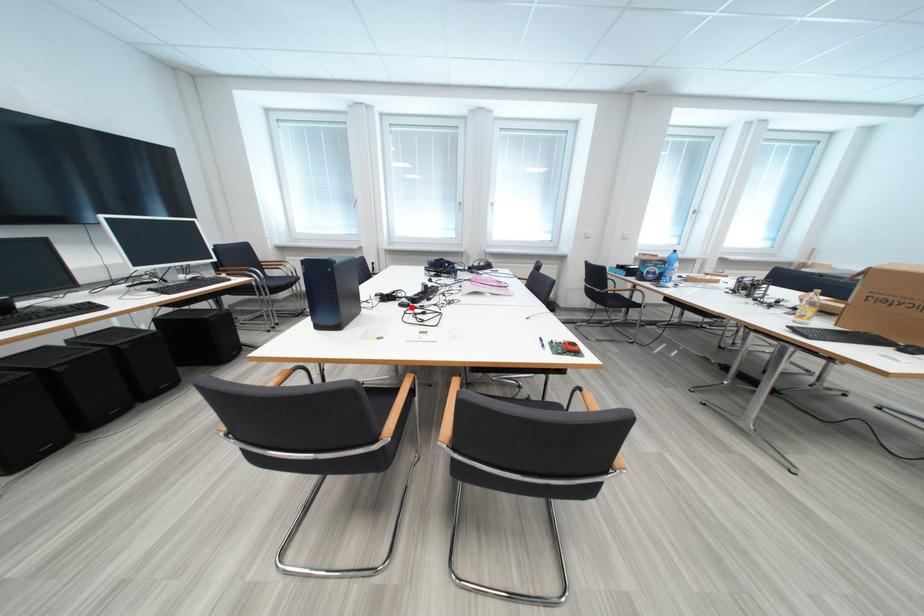
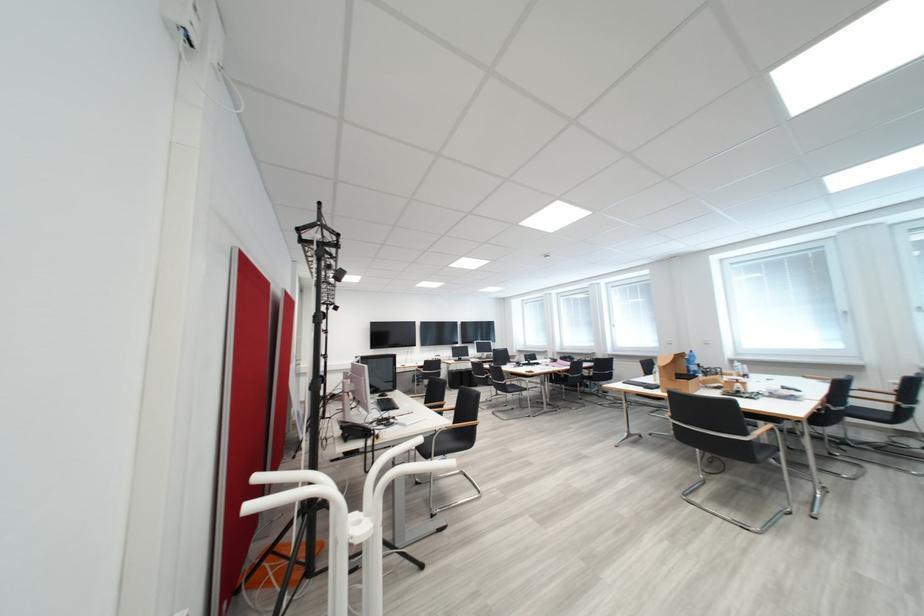
Question: I am providing you with two images of the same scene from different viewpoints. A red point is marked on the first image. Is the red point's position out of view in image 2?

Choices:
 (A) Yes
 (B) No

Answer: (A)